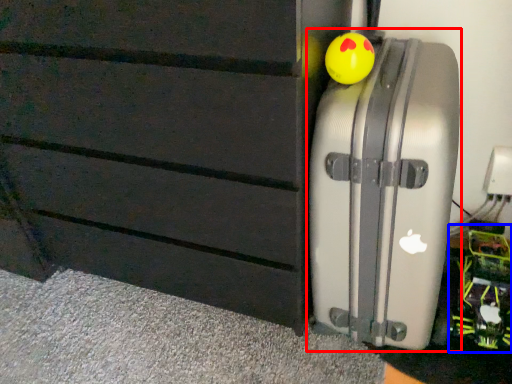
Question: Which of the following is the farthest to the observer, suitcase (highlighted by a red box) or toy (highlighted by a blue box)?

Choices:
 (A) suitcase
 (B) toy

Answer: (B)